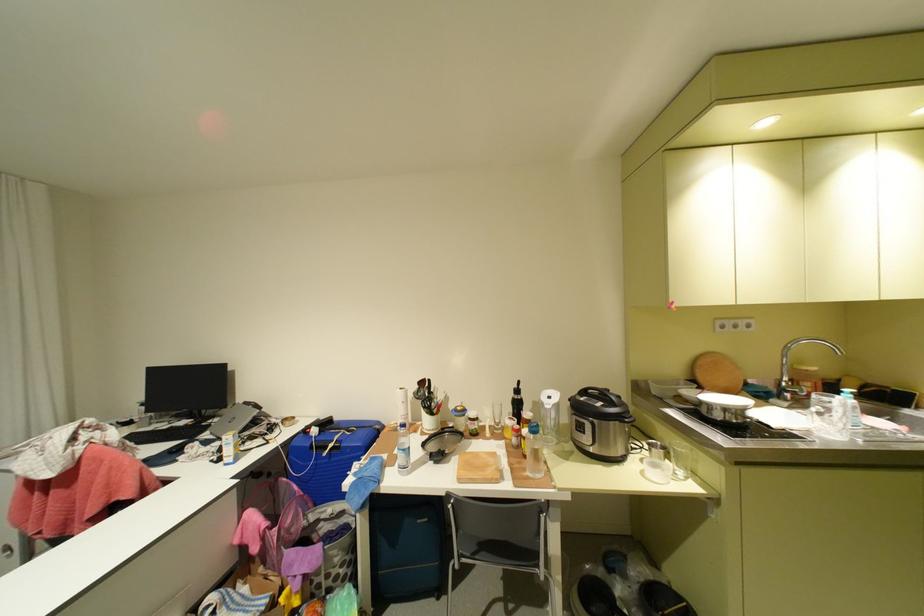
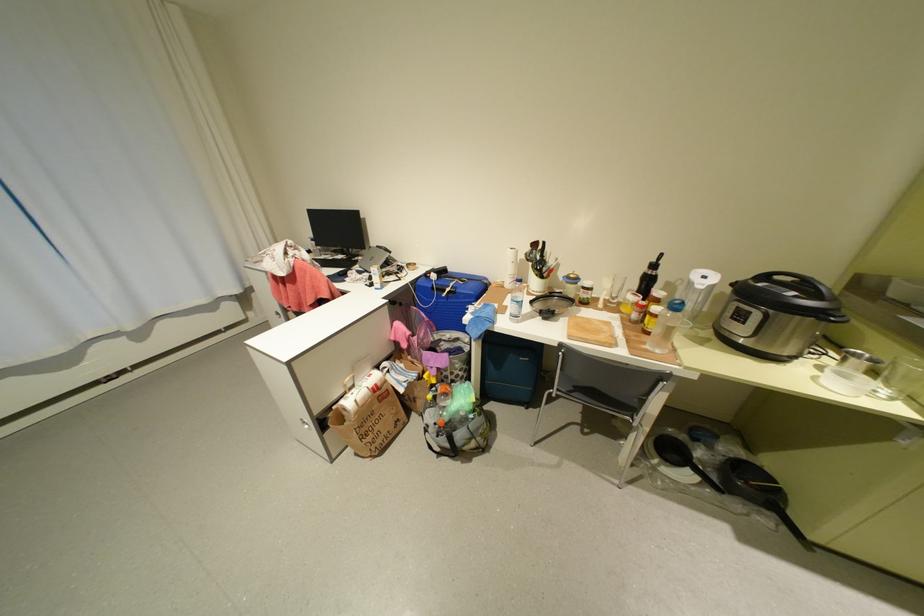
Where in the second image is the point corresponding to (x=525, y=418) from the first image?

(649, 294)